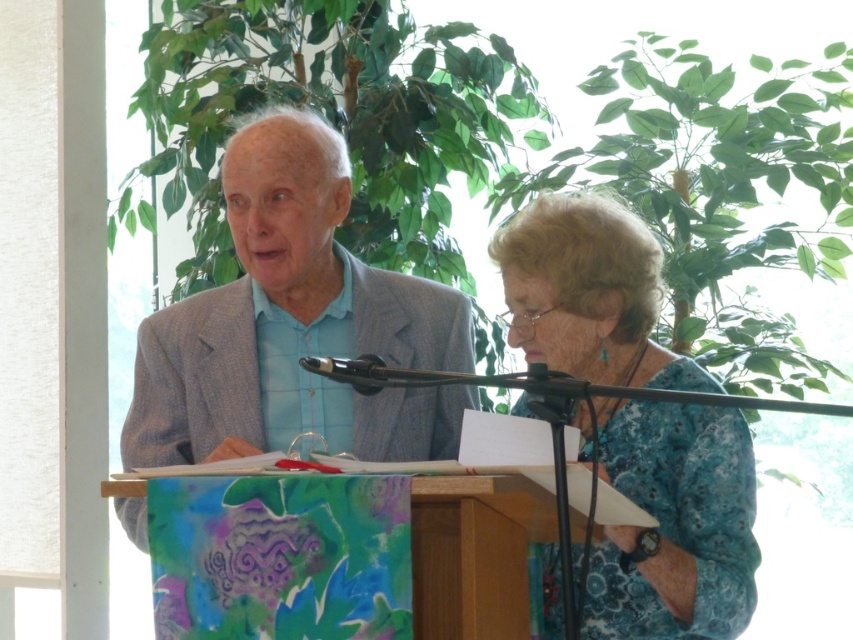
You are a photographer at the event and need to ensure the light blue shirt at center and the black metallic microphone at center are both visible in your photo. If the camera frame can only accommodate objects wider than 10 cm, will both items fit within the frame?

The light blue shirt at center is wider than the black metallic microphone at center. However, since the camera frame requires objects to be wider than 10 cm, we need to confirm if both meet this requirement. Unfortunately, the description does not provide specific measurements for either item, so we cannot determine if they will fit based on the given information.

You are organizing a photo shoot and need to ensure that the light blue shirt at center and the light gray suit at center are positioned so that the total width of both does not exceed 1.2 meters. According to the scene description, can their combined width fit within this constraint?

The light blue shirt at center might be wider than light gray suit at center, but without exact measurements, it is uncertain if their combined width would exceed 1.2 meters. Further information is needed to determine this.